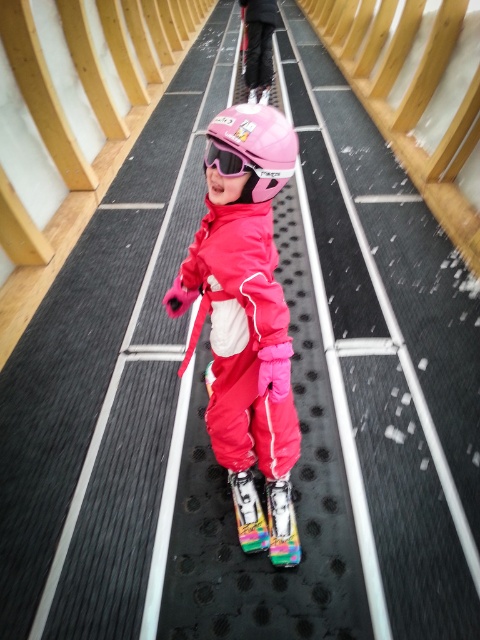
Question: Which object is farther from the camera taking this photo?

Choices:
 (A) matte black pants at center
 (B) pink matte ski goggles at center

Answer: (A)

Question: Observing the image, what is the correct spatial positioning of matte pink snowsuit at center in reference to pink matte ski goggles at center?

Choices:
 (A) left
 (B) right

Answer: (A)

Question: Is matte pink jacket at center positioned in front of pink matte helmet at center?

Choices:
 (A) no
 (B) yes

Answer: (A)

Question: Estimate the real-world distances between objects in this image. Which object is closer to the pink matte helmet at center?

Choices:
 (A) matte pink jacket at center
 (B) matte black pants at center
 (C) multicolored plastic ski at center
 (D) pink matte ski goggles at center

Answer: (D)

Question: Which object appears farthest from the camera in this image?

Choices:
 (A) matte black pants at center
 (B) pink matte ski goggles at center
 (C) pink matte helmet at center
 (D) multicolored plastic ski at center

Answer: (A)

Question: Observing the image, what is the correct spatial positioning of matte pink jacket at center in reference to pink matte ski goggles at center?

Choices:
 (A) below
 (B) above

Answer: (A)